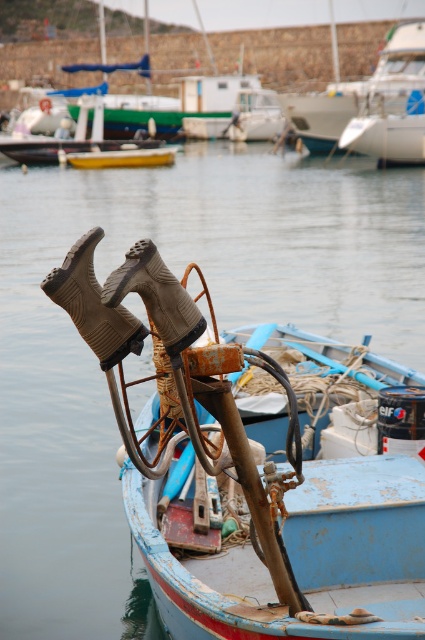
Between rusty metal boat at center and white glossy sailboat at upper right, which one is positioned lower?

rusty metal boat at center is lower down.

Who is shorter, rusty metal boat at center or white glossy sailboat at upper right?

With less height is rusty metal boat at center.

What do you see at coordinates (294, 508) in the screenshot? I see `rusty metal boat at center` at bounding box center [294, 508].

Where is `rusty metal boat at center`? The width and height of the screenshot is (425, 640). rusty metal boat at center is located at coordinates coord(294,508).